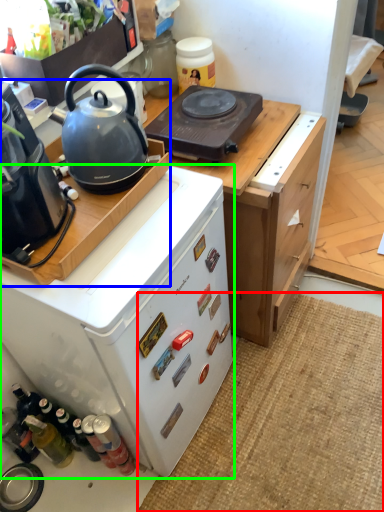
Question: Based on their relative distances, which object is farther from doormat (highlighted by a red box)? Choose from kitchen appliance (highlighted by a blue box) and home appliance (highlighted by a green box).

Choices:
 (A) kitchen appliance
 (B) home appliance

Answer: (A)